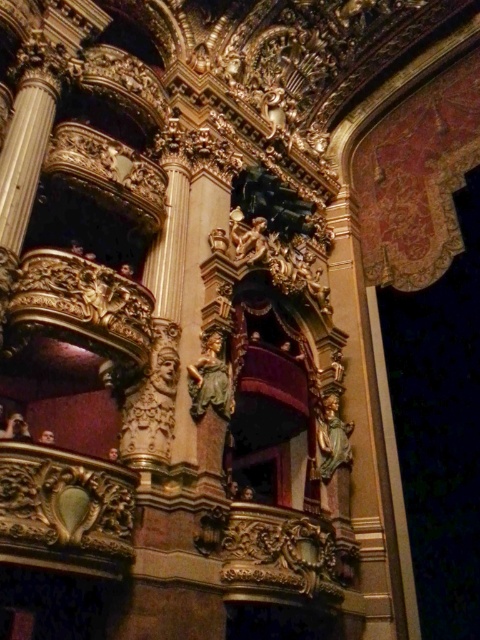
Question: Which point is closer to the camera?

Choices:
 (A) green marble statue at center
 (B) golden polished statue at center

Answer: (A)

Question: Does green marble statue at center appear over golden polished statue at center?

Choices:
 (A) no
 (B) yes

Answer: (B)

Question: Does green marble statue at center lie behind golden polished statue at center?

Choices:
 (A) no
 (B) yes

Answer: (A)

Question: Does green marble statue at center appear on the left side of golden polished statue at center?

Choices:
 (A) yes
 (B) no

Answer: (A)

Question: Which point is farther to the camera?

Choices:
 (A) (204, 392)
 (B) (340, 444)

Answer: (B)

Question: Among these points, which one is nearest to the camera?

Choices:
 (A) (220, 369)
 (B) (345, 456)

Answer: (A)